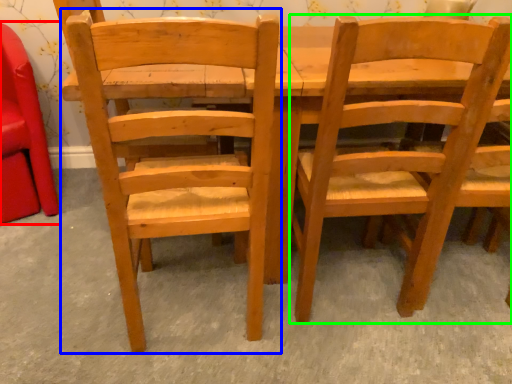
Question: Which object is the closest to the chair (highlighted by a red box)? Choose among these: chair (highlighted by a blue box) or chair (highlighted by a green box).

Choices:
 (A) chair
 (B) chair

Answer: (A)